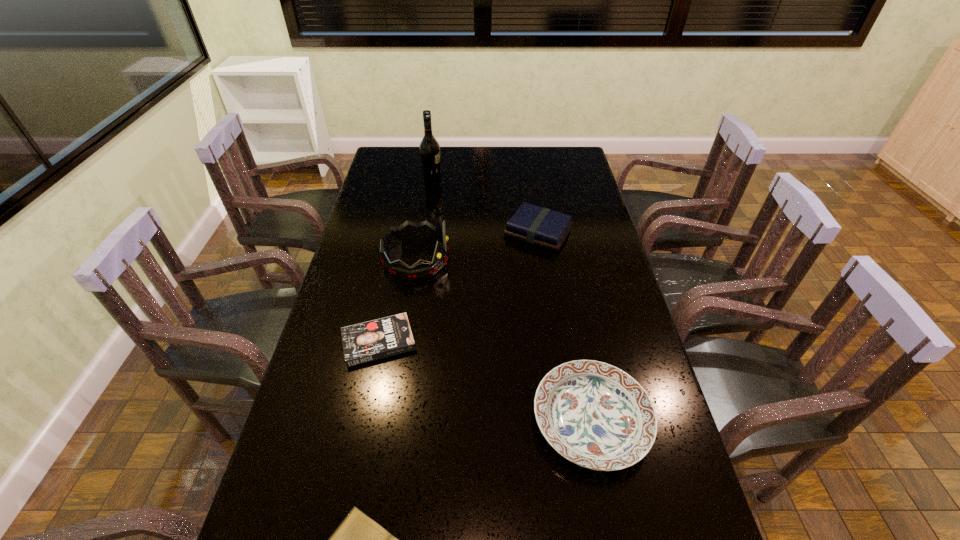
You are a GUI agent. You are given a task and a screenshot of the screen. Output one action in this format:
    pyautogui.click(x=<x>, y=<y>)
    Task: Click on the wine bottle
    This screenshot has width=960, height=540.
    Given the screenshot: What is the action you would take?
    pyautogui.click(x=429, y=148)

Where is `the farthest object`? This screenshot has width=960, height=540. the farthest object is located at coordinates (429, 148).

Where is `tiara`? tiara is located at coordinates (408, 231).

Where is `the rightmost book`? The width and height of the screenshot is (960, 540). the rightmost book is located at coordinates (536, 225).

This screenshot has height=540, width=960. I want to click on the farthest book, so click(536, 225).

This screenshot has width=960, height=540. What are the coordinates of `plate` in the screenshot? It's located at (597, 416).

Locate an element on the screen. The height and width of the screenshot is (540, 960). the second shortest object is located at coordinates (368, 341).

The height and width of the screenshot is (540, 960). I want to click on the second tallest book, so click(x=368, y=341).

You are a GUI agent. You are given a task and a screenshot of the screen. Output one action in this format:
    pyautogui.click(x=<x>, y=<y>)
    Task: Click on the vacant space situated 0.290m on the label of the farthest object
    This screenshot has height=540, width=960.
    Given the screenshot: What is the action you would take?
    pyautogui.click(x=510, y=178)

In order to click on free region located 0.360m at the front of the tiara with jewels in this screenshot , I will do `click(555, 259)`.